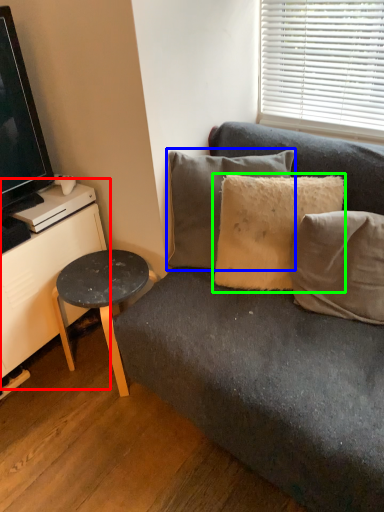
Question: Which object is the farthest from dresser (highlighted by a red box)? Choose among these: pillow (highlighted by a blue box) or pillow (highlighted by a green box).

Choices:
 (A) pillow
 (B) pillow

Answer: (B)